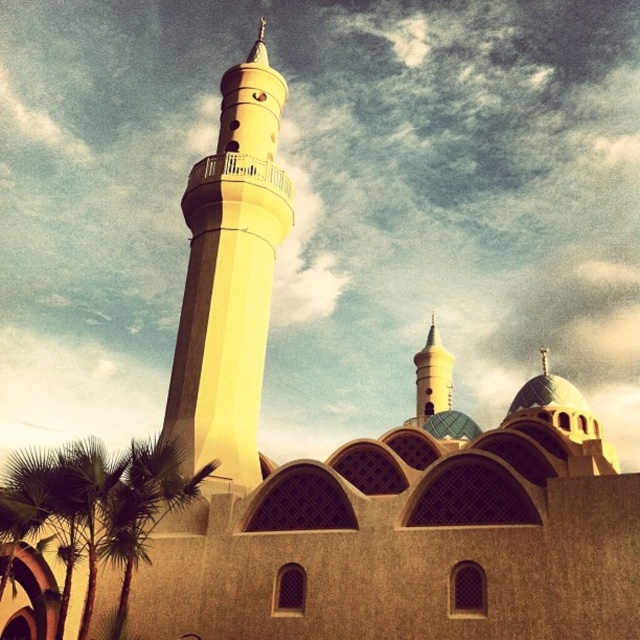
Question: Where is yellow concrete minaret at center located in relation to green leafy palm tree at lower left in the image?

Choices:
 (A) right
 (B) left

Answer: (A)

Question: Which point is closer to the camera taking this photo?

Choices:
 (A) (161, 465)
 (B) (241, 68)

Answer: (A)

Question: Does yellow concrete minaret at center have a lesser width compared to green leafy palm tree at lower left?

Choices:
 (A) no
 (B) yes

Answer: (B)

Question: Which point is closer to the camera taking this photo?

Choices:
 (A) (36, 515)
 (B) (230, 200)

Answer: (A)

Question: Is yellow concrete minaret at center behind green leafy palm tree at lower left?

Choices:
 (A) no
 (B) yes

Answer: (B)